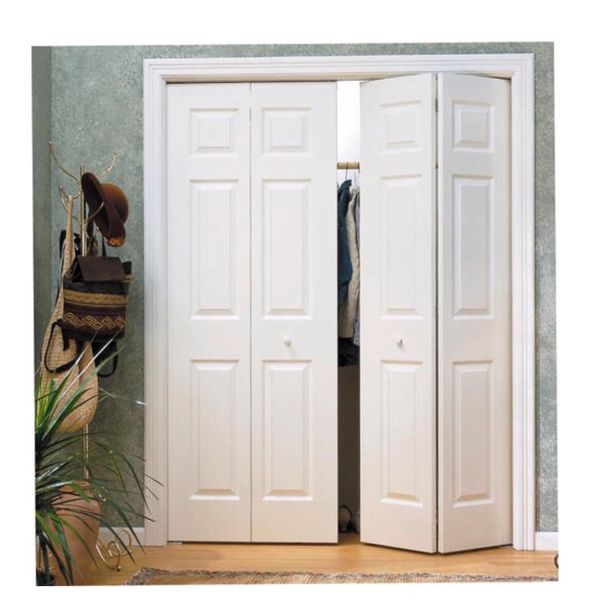
Locate an element on the screen. The width and height of the screenshot is (600, 600). floor is located at coordinates (337, 567).